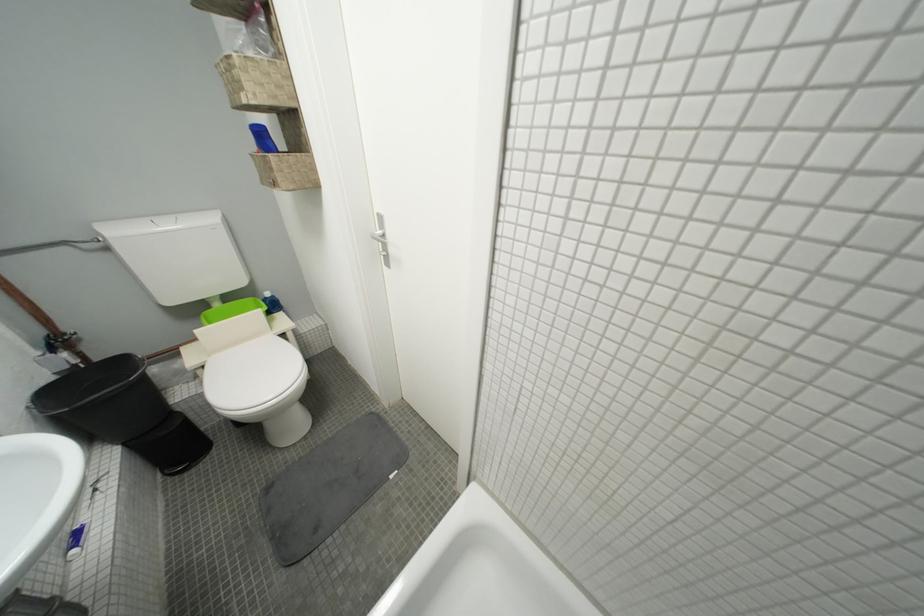
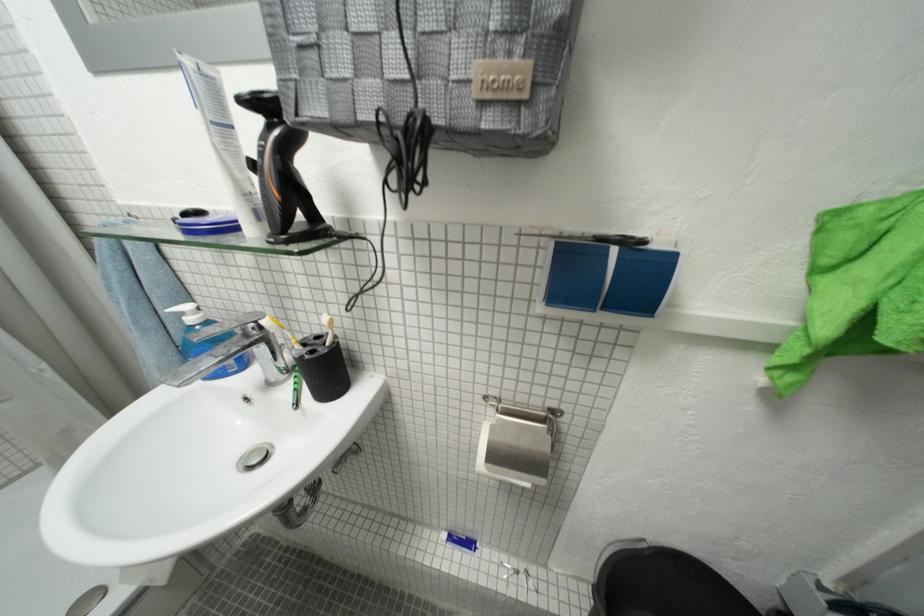
Where in the second image is the point corresponding to pixel 81 554 from the first image?

(454, 538)